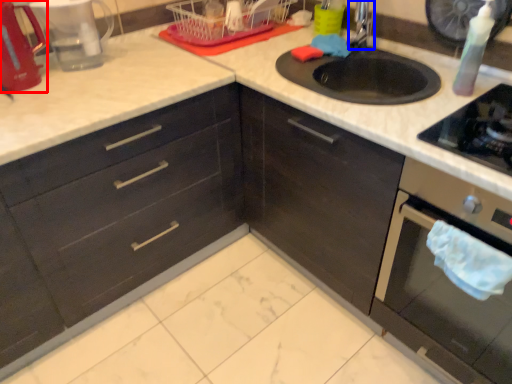
Question: Which object is closer to the camera taking this photo, appliance (highlighted by a red box) or faucet (highlighted by a blue box)?

Choices:
 (A) appliance
 (B) faucet

Answer: (A)